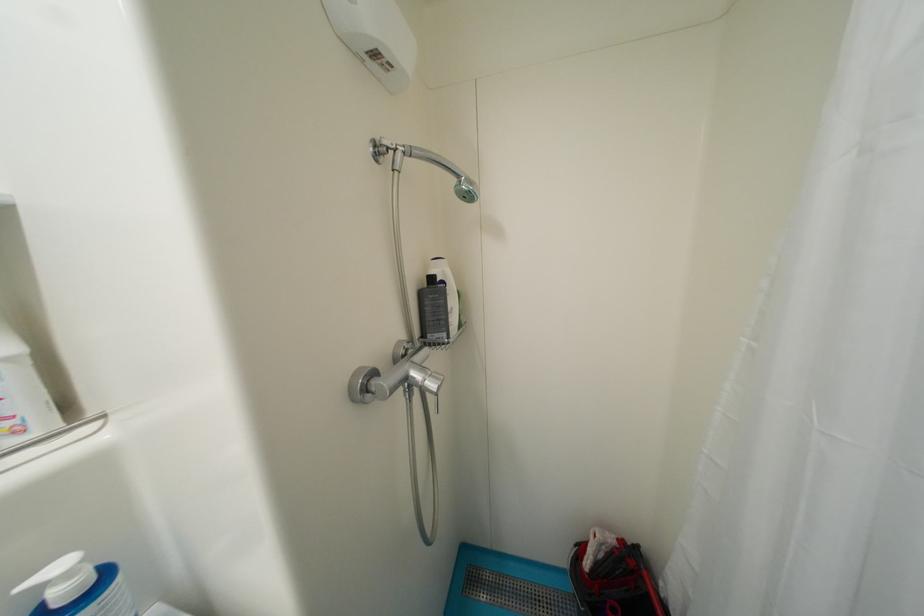
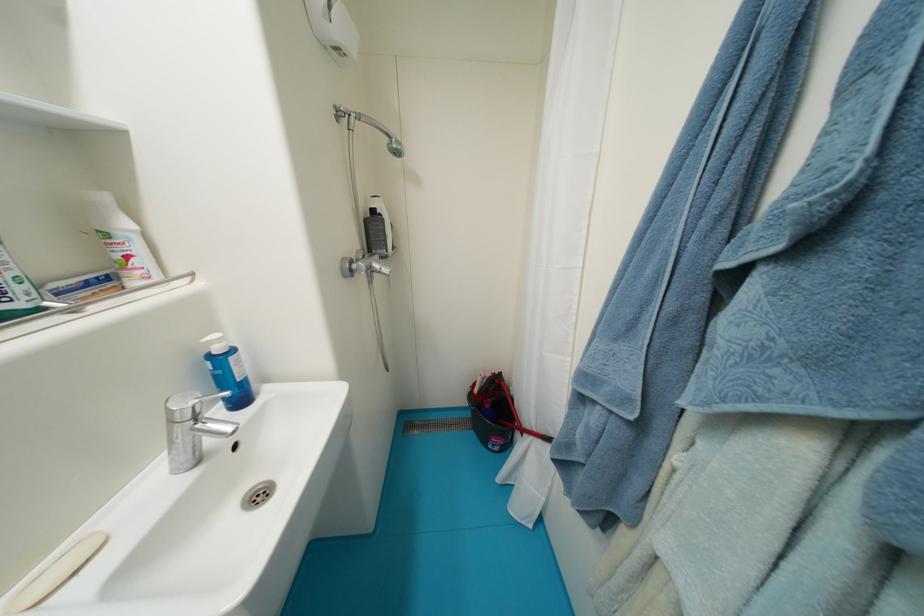
Question: I am providing you with two images of the same scene from different viewpoints. Please identify which objects are invisible in image2.

Choices:
 (A) blue dispenser pump
 (B) black dispenser pump
 (C) silver faucet handle
 (D) none of these

Answer: (D)